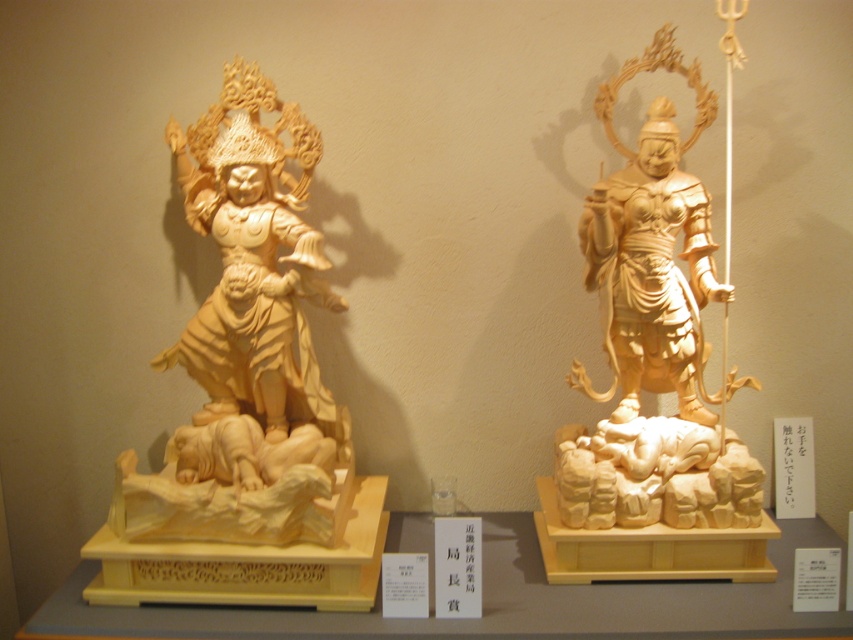
Consider the image. Is light wood statue at center smaller than light wood statue at right?

No, light wood statue at center is not smaller than light wood statue at right.

Can you confirm if light wood statue at center is positioned to the left of light wood statue at right?

Incorrect, light wood statue at center is not on the left side of light wood statue at right.

The height and width of the screenshot is (640, 853). What do you see at coordinates (653, 253) in the screenshot? I see `light wood statue at center` at bounding box center [653, 253].

This screenshot has height=640, width=853. Find the location of `light wood statue at center`. light wood statue at center is located at coordinates (653, 253).

Does light wood statue at left have a lesser width compared to light wood statue at center?

No, light wood statue at left is not thinner than light wood statue at center.

Can you confirm if light wood statue at left is shorter than light wood statue at center?

Yes.

Between point (267, 384) and point (614, 380), which one is positioned in front?

Point (614, 380) is in front.

This screenshot has width=853, height=640. In order to click on light wood statue at left in this screenshot , I will do `click(248, 396)`.

Is point (241, 513) closer to camera compared to point (614, 378)?

That is True.

Can you confirm if light wood statue at left is positioned above light wood statue at right?

Actually, light wood statue at left is below light wood statue at right.

Who is more forward, (252, 358) or (646, 170)?

Point (646, 170)

Where is `light wood statue at left`? Image resolution: width=853 pixels, height=640 pixels. light wood statue at left is located at coordinates (248, 396).